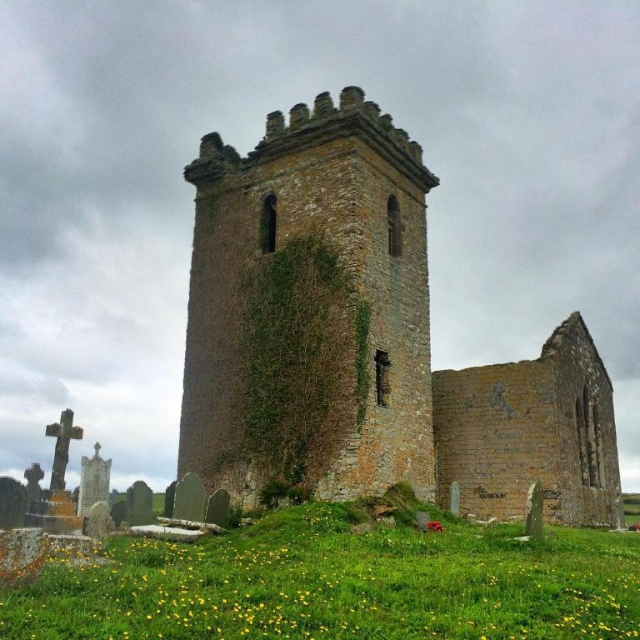
Question: Which object is positioned farthest from the green mossy wall at center?

Choices:
 (A) brown stone tower at center
 (B) green grassy field at lower center

Answer: (B)

Question: Among these points, which one is nearest to the camera?

Choices:
 (A) (355, 145)
 (B) (253, 440)
 (C) (467, 611)

Answer: (C)

Question: Is brown stone tower at center to the left of green mossy wall at center from the viewer's perspective?

Choices:
 (A) no
 (B) yes

Answer: (A)

Question: Estimate the real-world distances between objects in this image. Which object is farther from the green grassy field at lower center?

Choices:
 (A) brown stone tower at center
 (B) green mossy wall at center

Answer: (A)

Question: Is brown stone tower at center further to the viewer compared to green grassy field at lower center?

Choices:
 (A) yes
 (B) no

Answer: (A)

Question: Can you confirm if brown stone tower at center is bigger than green grassy field at lower center?

Choices:
 (A) no
 (B) yes

Answer: (B)